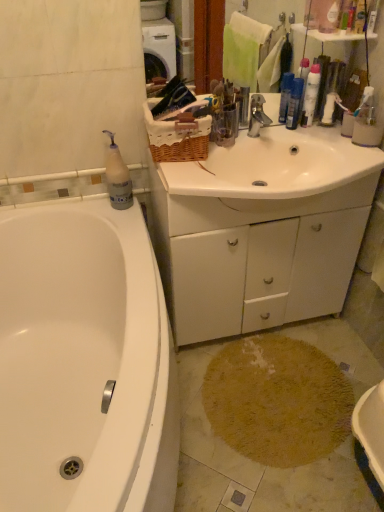
Find the location of a particular element. The image size is (384, 512). free location to the left of translucent plastic bottle at upper left, the first cleaning product from the left is located at coordinates (73, 206).